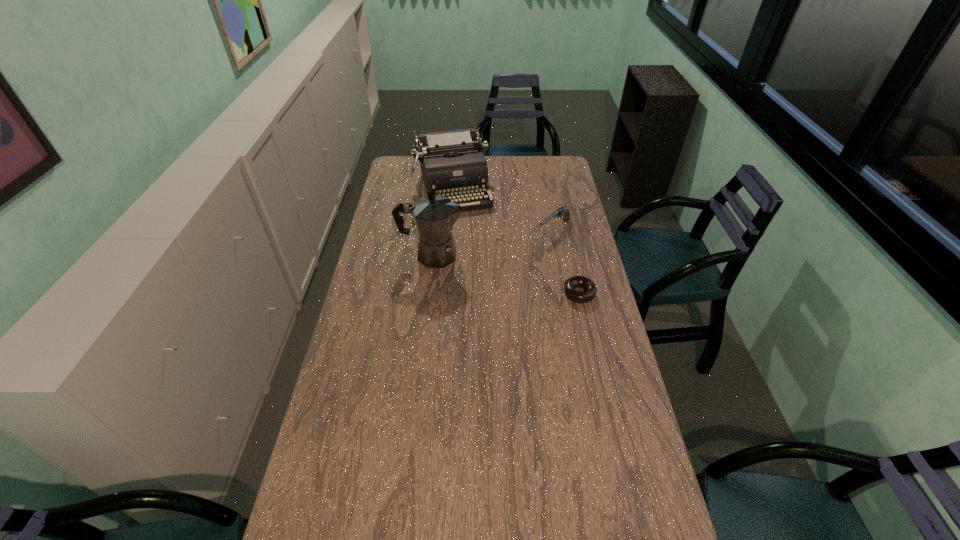
In the image, there is a desktop. Where is `vacant region at the far edge`? vacant region at the far edge is located at coordinates (533, 158).

This screenshot has width=960, height=540. What are the coordinates of `vacant space at the near edge of the desktop` in the screenshot? It's located at (478, 515).

This screenshot has height=540, width=960. I want to click on free space at the left edge of the desktop, so click(332, 422).

Where is `free space at the right edge of the desktop`? The image size is (960, 540). free space at the right edge of the desktop is located at coordinates (580, 226).

This screenshot has width=960, height=540. In the image, there is a desktop. Identify the location of vacant space at the near left corner. (x=318, y=509).

Identify the location of free space at the far right corner of the desktop. The height and width of the screenshot is (540, 960). (549, 172).

In order to click on vacant space that is in between the typewriter and the shortest object in this screenshot , I will do `click(516, 241)`.

Identify the location of free point between the third farthest object and the gun. The image size is (960, 540). (493, 242).

Image resolution: width=960 pixels, height=540 pixels. Identify the location of free space between the coffeepot and the gun. (493, 242).

Image resolution: width=960 pixels, height=540 pixels. What are the coordinates of `free spot between the shortest object and the second tallest object` in the screenshot? It's located at (516, 241).